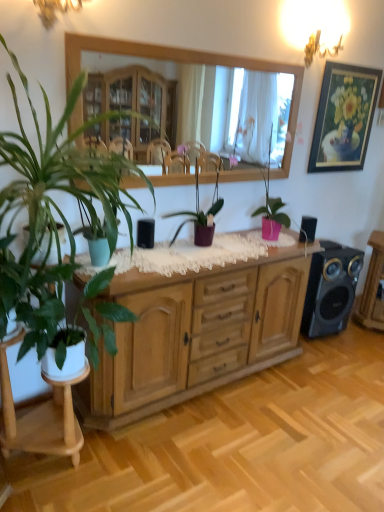
In order to click on vacant point above wooden cabinet at center (from a real-world perspective) in this screenshot , I will do `click(187, 251)`.